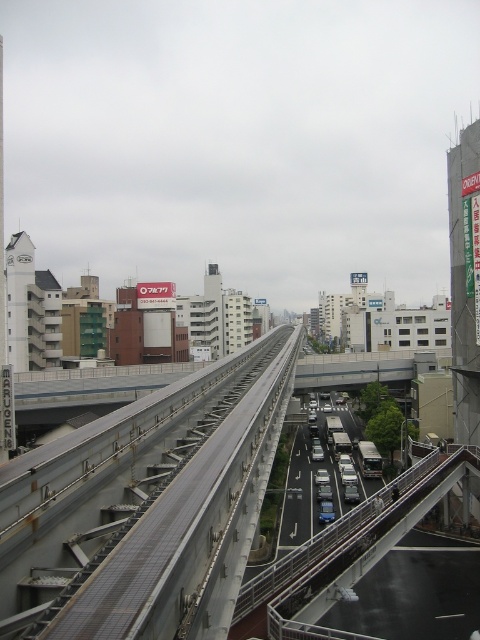
Question: Is metallic gray highway at center to the right of metallic blue sedan at center from the viewer's perspective?

Choices:
 (A) no
 (B) yes

Answer: (A)

Question: Does metallic gray train track at center come behind metallic blue sedan at center?

Choices:
 (A) no
 (B) yes

Answer: (A)

Question: Does metallic gray highway at center have a lesser width compared to metallic blue sedan at center?

Choices:
 (A) no
 (B) yes

Answer: (A)

Question: Which point appears closest to the camera in this image?

Choices:
 (A) (313, 358)
 (B) (320, 474)
 (C) (457, 458)
 (D) (64, 497)

Answer: (D)

Question: Which point appears farthest from the camera in this image?

Choices:
 (A) (269, 596)
 (B) (339, 372)

Answer: (B)

Question: Which point is closer to the camera?

Choices:
 (A) white concrete overpass at center
 (B) metallic gray highway at center
 (C) metallic blue sedan at center

Answer: (B)